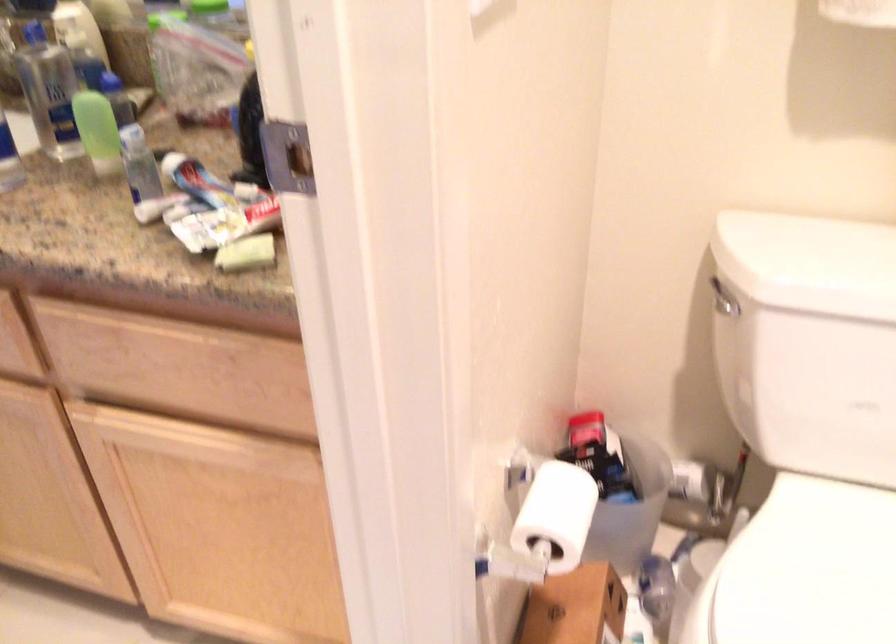
What do you see at coordinates (48, 91) in the screenshot? I see `a bottle pump dispenser` at bounding box center [48, 91].